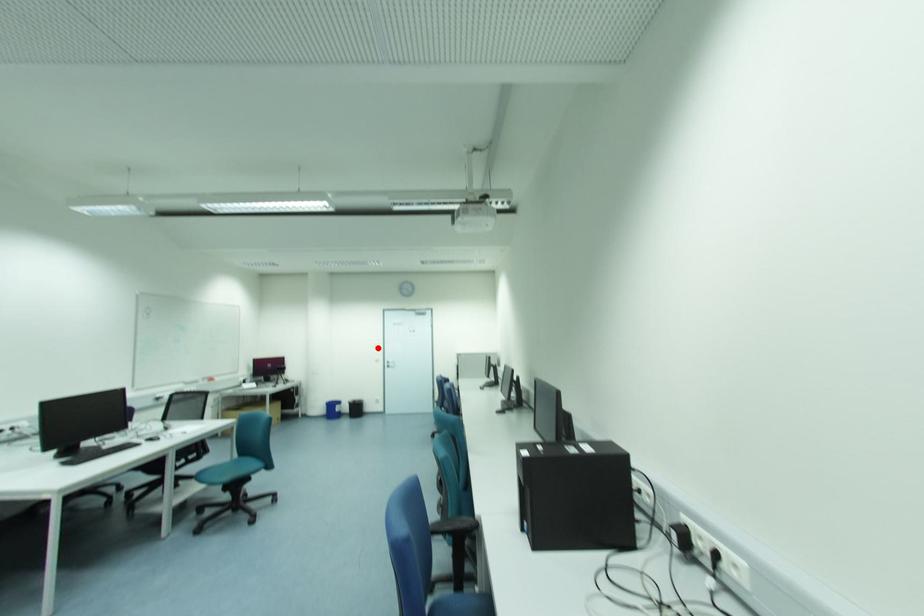
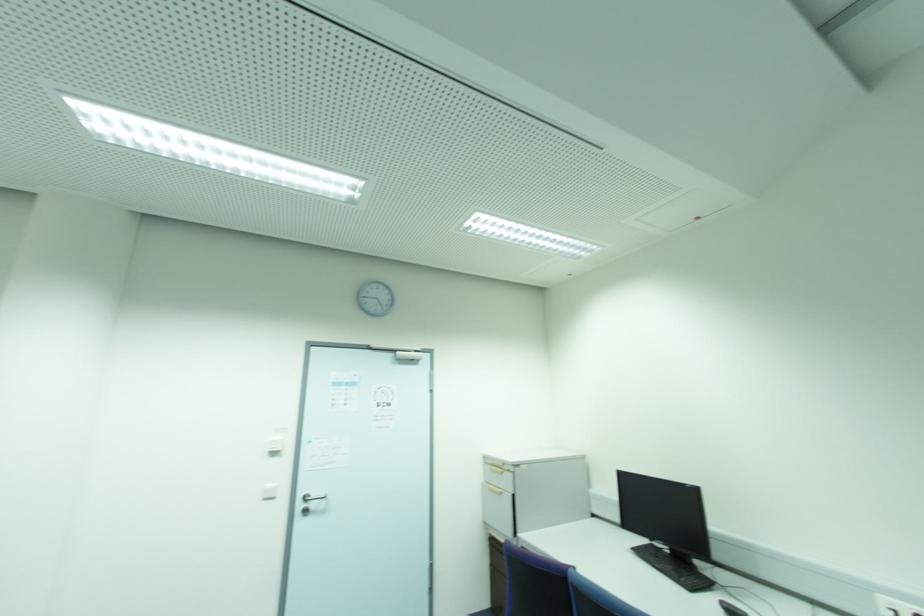
Question: A red point is marked in image1. In image2, is the corresponding 3D point closer to the camera or farther? Reply with the corresponding letter.

Choices:
 (A) The corresponding 3D point is closer.
 (B) The corresponding 3D point is farther.

Answer: (A)